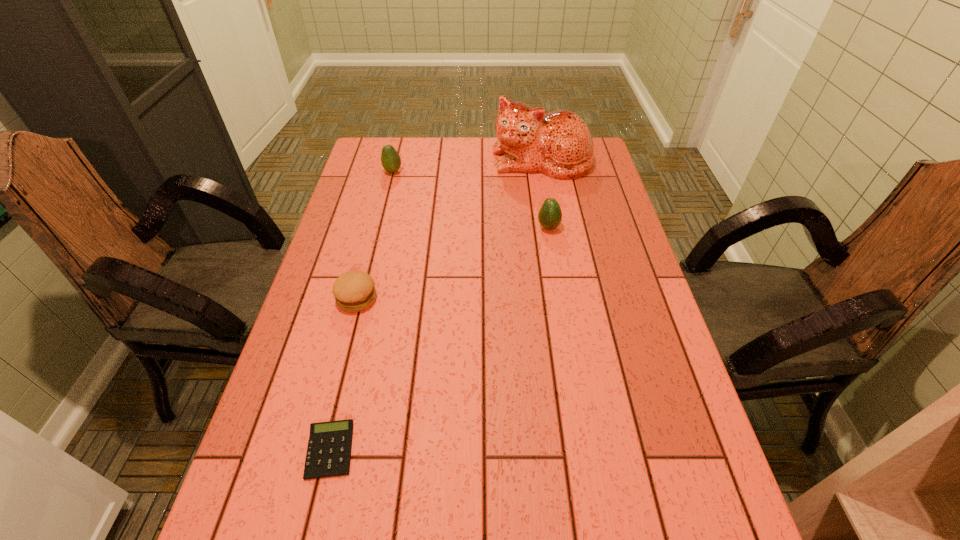
I want to click on object that is positioned at the far right corner, so click(559, 144).

You are a GUI agent. You are given a task and a screenshot of the screen. Output one action in this format:
    pyautogui.click(x=<x>, y=<y>)
    Task: Click on the vacant space at the far edge
    
    Given the screenshot: What is the action you would take?
    pyautogui.click(x=416, y=160)

Locate an element on the screen. The width and height of the screenshot is (960, 540). vacant space at the left edge of the desktop is located at coordinates (296, 520).

You are a GUI agent. You are given a task and a screenshot of the screen. Output one action in this format:
    pyautogui.click(x=<x>, y=<y>)
    Task: Click on the free space at the right edge
    The height and width of the screenshot is (540, 960).
    Given the screenshot: What is the action you would take?
    pyautogui.click(x=612, y=233)

Find the location of `free point between the cat and the calculator`. free point between the cat and the calculator is located at coordinates (436, 306).

This screenshot has height=540, width=960. What are the coordinates of `vacant region between the hamburger and the calculator` in the screenshot? It's located at (344, 374).

Locate an element on the screen. The width and height of the screenshot is (960, 540). free spot between the left avocado and the hamburger is located at coordinates (375, 235).

Locate an element on the screen. This screenshot has height=540, width=960. free point between the hamburger and the shortest object is located at coordinates (344, 374).

The height and width of the screenshot is (540, 960). I want to click on free spot between the farther avocado and the fourth tallest object, so (375, 235).

The image size is (960, 540). What are the coordinates of `vacant point located between the tallest object and the fourth farthest object` in the screenshot? It's located at (449, 230).